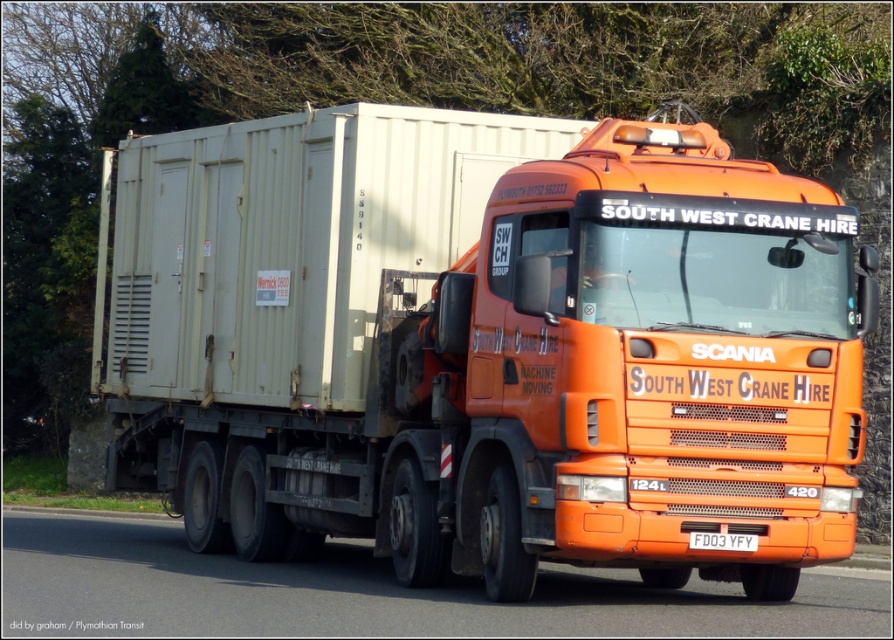
You are a traffic officer observing a vehicle. The vehicle has an orange matte truck at center and a white plastic license plate at center. Which object is closer to you?

The orange matte truck at center is closer to you since it is in front of the white plastic license plate at center.

You are a delivery driver who needs to check the distance between the orange glossy truck at center and the white plastic license plate at center to ensure proper cargo loading. According to safety regulations, the minimum safe distance between the truck and the license plate should be 8 feet. Is the current distance compliant?

The orange glossy truck at center is 10.45 feet from the white plastic license plate at center, which exceeds the minimum required 8 feet, so it is compliant with safety regulations.